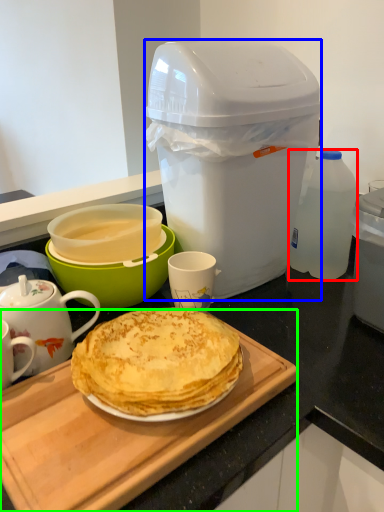
Question: Based on their relative distances, which object is nearer to bottle (highlighted by a red box)? Choose from trash bin/can (highlighted by a blue box) and cutting board (highlighted by a green box).

Choices:
 (A) trash bin/can
 (B) cutting board

Answer: (A)